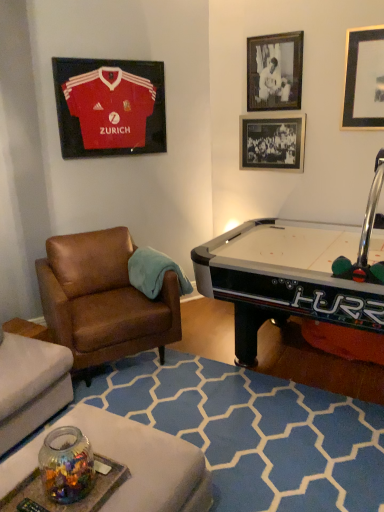
Locate an element on the screen. The width and height of the screenshot is (384, 512). empty space that is ontop of matte jersey at upper left, positioned as the 1th picture frame in left-to-right order (from a real-world perspective) is located at coordinates (100, 60).